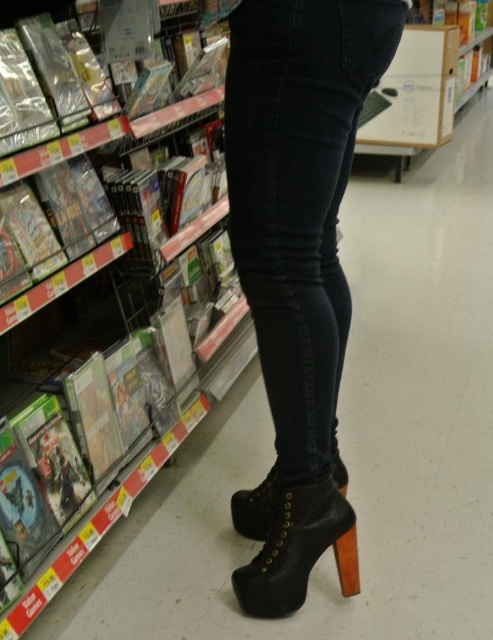
You are a store employee who needs to determine if the dark blue denim jeans at center can be seen above the black leather boot at center from the customer perspective. Can you confirm this?

The dark blue denim jeans at center is taller than black leather boot at center, so yes, the jeans can be seen above the boot from the customer perspective.

You are a store employee who needs to ensure that the dark blue denim jeans at center and the black leather boot at lower center are displayed properly. According to the store policy, items must be arranged so that taller items are placed behind shorter ones to avoid blocking views. Can you arrange them correctly?

The dark blue denim jeans at center is taller than the black leather boot at lower center. To comply with store policy, the dark blue denim jeans at center should be placed behind the black leather boot at lower center so that the shorter boot is in front and the taller jeans are behind to avoid blocking the view.